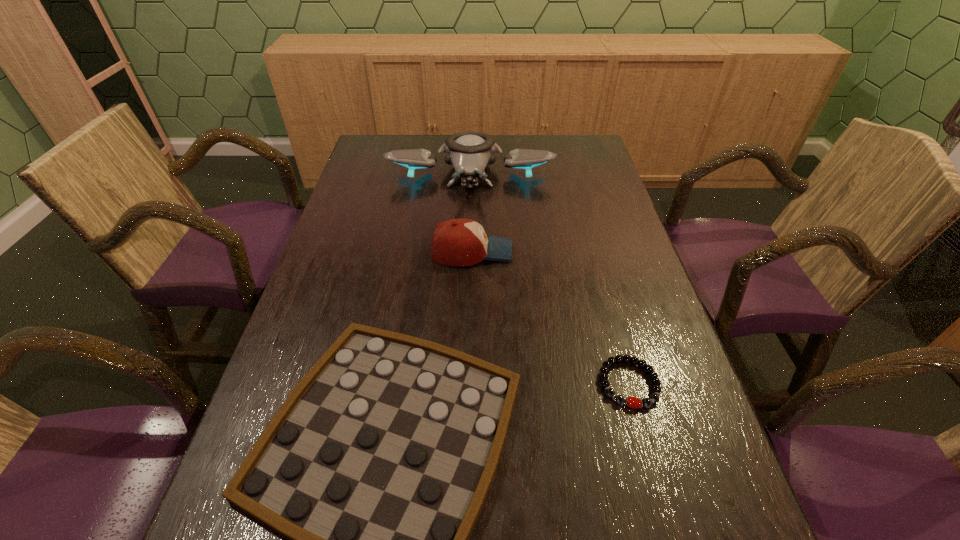
In the image, there is a desktop. Identify the location of vacant region at the far edge. (419, 143).

You are a GUI agent. You are given a task and a screenshot of the screen. Output one action in this format:
    pyautogui.click(x=<x>, y=<y>)
    Task: Click on the free space at the left edge of the desktop
    
    Given the screenshot: What is the action you would take?
    pyautogui.click(x=361, y=236)

Identify the location of vacant position at the right edge of the desktop. The width and height of the screenshot is (960, 540). (609, 387).

Find the location of a particular element. Image resolution: width=960 pixels, height=540 pixels. free space at the far left corner is located at coordinates (366, 155).

The height and width of the screenshot is (540, 960). I want to click on free space that is in between the drone and the third nearest object, so click(x=471, y=212).

At what (x,y) coordinates should I click in order to perform the action: click on free spot between the drone and the baseball cap. Please return your answer as a coordinate pair (x, y). The width and height of the screenshot is (960, 540). Looking at the image, I should click on (471, 212).

The image size is (960, 540). Identify the location of vacant area that lies between the shortest object and the drone. (549, 278).

The image size is (960, 540). What are the coordinates of `free spot between the baseball cap and the farthest object` in the screenshot? It's located at (471, 212).

Where is `unoccupied position between the shortest object and the third nearest object`? The height and width of the screenshot is (540, 960). unoccupied position between the shortest object and the third nearest object is located at coordinates (550, 318).

In order to click on free area in between the drone and the third nearest object in this screenshot , I will do coord(471,212).